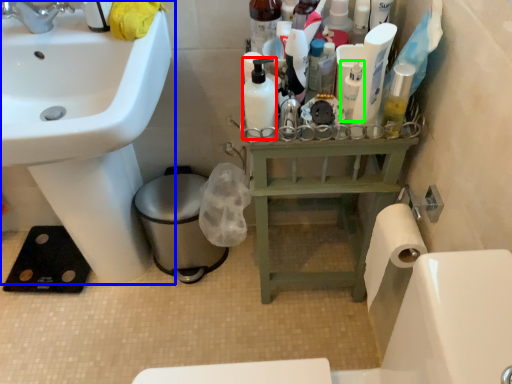
Question: Considering the real-world distances, which object is farthest from mouthwash (highlighted by a red box)? sink (highlighted by a blue box) or toiletry (highlighted by a green box)?

Choices:
 (A) sink
 (B) toiletry

Answer: (A)